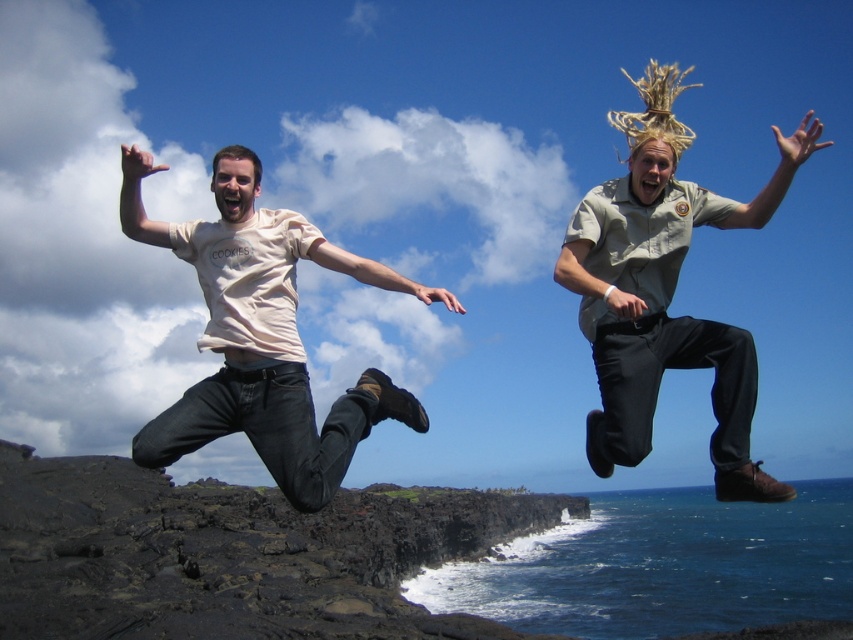
You are a photographer planning to take a photo of the two people in the scene. You want to ensure the black volcanic rock at lower left is not in the frame. Where should you position yourself relative to the current viewpoint to avoid including it?

To avoid including the black volcanic rock at lower left in the frame, position yourself to the right or above the current viewpoint since the rock is located at point (x=234, y=554), which is towards the lower left corner of the image.

You are planning to place a small decorative item on the black volcanic rock at lower left. Based on the scene, will the khaki uniform at right interfere with the placement?

The black volcanic rock at lower left occupies less space than the khaki uniform at right, so placing a small decorative item on the black volcanic rock at lower left may be possible, but the khaki uniform at right might block access or visibility depending on their position.